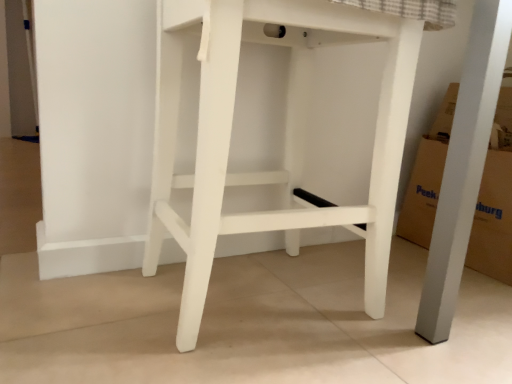
The width and height of the screenshot is (512, 384). What are the coordinates of `cardboard at right` in the screenshot? It's located at (495, 203).

This screenshot has height=384, width=512. What do you see at coordinates (495, 203) in the screenshot?
I see `cardboard at right` at bounding box center [495, 203].

The height and width of the screenshot is (384, 512). Find the location of `white matte stool at center`. white matte stool at center is located at coordinates 286,136.

In order to face white matte stool at center, should I rotate leftwards or rightwards?

You should look right and rotate roughly 2.390 degrees.

This screenshot has height=384, width=512. What do you see at coordinates (286, 136) in the screenshot?
I see `white matte stool at center` at bounding box center [286, 136].

This screenshot has height=384, width=512. Find the location of `cardboard at right`. cardboard at right is located at coordinates (495, 203).

Considering the relative positions of white matte stool at center and cardboard at right in the image provided, is white matte stool at center to the left of cardboard at right from the viewer's perspective?

Indeed, white matte stool at center is positioned on the left side of cardboard at right.

Which is behind, white matte stool at center or cardboard at right?

Positioned behind is cardboard at right.

Does point (168, 8) come in front of point (501, 116)?

Yes, point (168, 8) is in front of point (501, 116).

From the image's perspective, which is above, white matte stool at center or cardboard at right?

white matte stool at center, from the image's perspective.

Consider the image. From a real-world perspective, relative to cardboard at right, is white matte stool at center vertically above or below?

In terms of real-world spatial position, white matte stool at center is above cardboard at right.

Which object is thinner, white matte stool at center or cardboard at right?

Thinner between the two is cardboard at right.

Who is taller, white matte stool at center or cardboard at right?

white matte stool at center.

Looking at the image, does white matte stool at center seem bigger or smaller compared to cardboard at right?

In the image, white matte stool at center appears to be larger than cardboard at right.

From the picture: Do you think white matte stool at center is within cardboard at right, or outside of it?

white matte stool at center is spatially situated outside cardboard at right.

Is white matte stool at center not close to cardboard at right?

No, white matte stool at center is in close proximity to cardboard at right.

Is white matte stool at center aimed at cardboard at right?

Yes, white matte stool at center faces towards cardboard at right.

This screenshot has width=512, height=384. I want to click on furniture that appears above the cardboard at right (from a real-world perspective), so click(x=286, y=136).

Is cardboard at right at the right side of white matte stool at center?

Indeed, cardboard at right is positioned on the right side of white matte stool at center.

Which is in front, cardboard at right or white matte stool at center?

white matte stool at center is more forward.

Considering the positions of point (501, 187) and point (377, 33), is point (501, 187) closer or farther from the camera than point (377, 33)?

Point (501, 187).

From the image's perspective, is cardboard at right under white matte stool at center?

Yes, from the image's perspective, cardboard at right is below white matte stool at center.

From a real-world perspective, is cardboard at right located beneath white matte stool at center?

Correct, in the physical world, cardboard at right is lower than white matte stool at center.

Between cardboard at right and white matte stool at center, which one has smaller width?

With smaller width is cardboard at right.

Can you confirm if cardboard at right is shorter than white matte stool at center?

Indeed, cardboard at right has a lesser height compared to white matte stool at center.

Between cardboard at right and white matte stool at center, which one has larger size?

Bigger between the two is white matte stool at center.

Consider the image. Which is correct: cardboard at right is inside white matte stool at center, or outside of it?

cardboard at right is not enclosed by white matte stool at center.

Are cardboard at right and white matte stool at center far apart?

No, cardboard at right is not far away from white matte stool at center.

Does cardboard at right turn towards white matte stool at center?

No, cardboard at right does not turn towards white matte stool at center.

Identify the location of cardboard box below the white matte stool at center (from the image's perspective). (495, 203).

Where is `cardboard box that appears behind the white matte stool at center`? The height and width of the screenshot is (384, 512). cardboard box that appears behind the white matte stool at center is located at coordinates (495, 203).

I want to click on cardboard box on the right of white matte stool at center, so click(x=495, y=203).